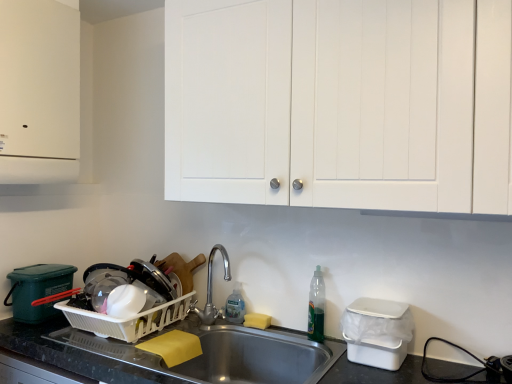
Question: In the image, is translucent plastic bottle at sink right, acting as the first bottle starting from the front, positioned in front of or behind white matte cabinet doors at upper center, arranged as the 1th cabinetry when viewed from the right?

Choices:
 (A) front
 (B) behind

Answer: (B)

Question: Based on their sizes in the image, would you say translucent plastic bottle at sink right, arranged as the second bottle when viewed from the back, is bigger or smaller than white matte cabinet doors at upper center, arranged as the 1th cabinetry when viewed from the right?

Choices:
 (A) big
 (B) small

Answer: (B)

Question: Estimate the real-world distances between objects in this image. Which object is farther from the white matte cabinet at upper left, the 1th cabinetry positioned from the left?

Choices:
 (A) yellow sponge at sink
 (B) stainless steel sink at lower center
 (C) clear plastic bottle at sink, the 1th bottle from the back
 (D) white matte cabinet doors at upper center, arranged as the 1th cabinetry when viewed from the right
 (E) translucent plastic bottle at sink right, acting as the first bottle starting from the front

Answer: (E)

Question: Estimate the real-world distances between objects in this image. Which object is closer to the stainless steel sink at lower center?

Choices:
 (A) translucent plastic bottle at sink right, the second bottle in the left-to-right sequence
 (B) white plastic dish rack at lower left, marked as the 2th appliance in a front-to-back arrangement
 (C) white matte cabinet doors at upper center, arranged as the 1th cabinetry when viewed from the right
 (D) white plastic container at lower right, placed as the second appliance when sorted from back to front
 (E) clear plastic bottle at sink, the 2th bottle positioned from the right

Answer: (E)